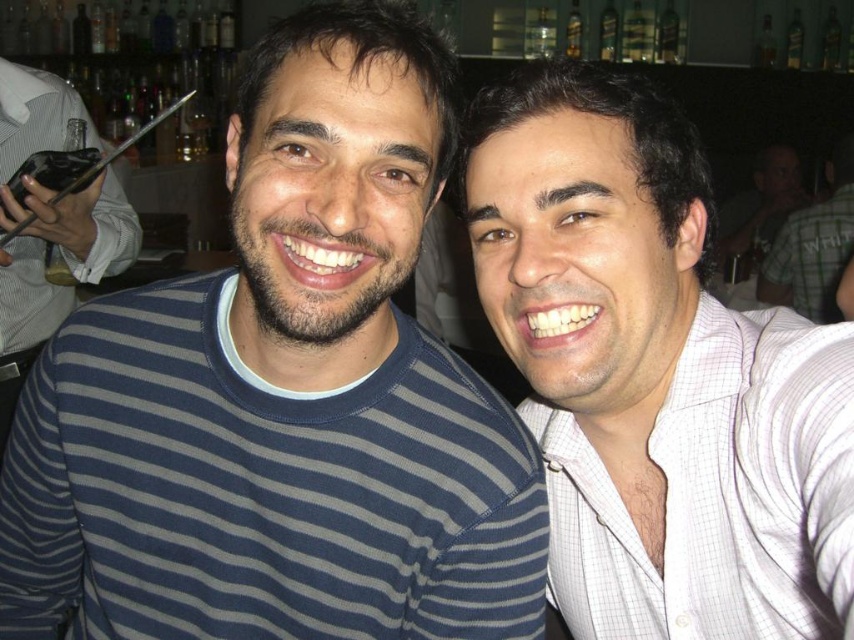
You are trying to take a photo of the blue striped sweater at center and the matte black phone at left. Based on their sizes, which object would appear larger in the photo?

The blue striped sweater at center would appear larger in the photo because its width is larger than the matte black phone at left.

You are taking a photo of two people standing at point (326, 580) and point (83, 150). Which point is closer to the camera?

Point (326, 580) is in front of point (83, 150), so it is closer to the camera.